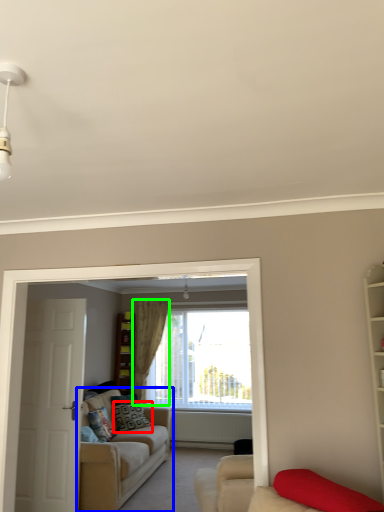
Question: Based on their relative distances, which object is farther from pillow (highlighted by a red box)? Choose from studio couch (highlighted by a blue box) and curtain (highlighted by a green box).

Choices:
 (A) studio couch
 (B) curtain

Answer: (B)